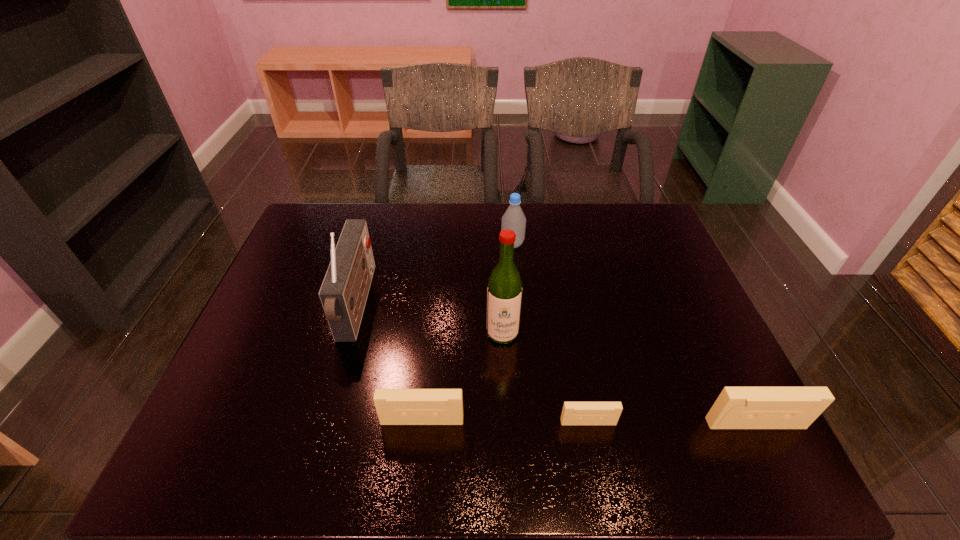
Locate an element on the screen. The height and width of the screenshot is (540, 960). object that is the closest to the shortest object is located at coordinates (736, 407).

What are the coordinates of `object that stands as the third closest to the shortest videotape` in the screenshot? It's located at (504, 292).

Locate which videotape is the closest to the shortest videotape. Please provide its 2D coordinates. Your answer should be formatted as a tuple, i.e. [(x, y)], where the tuple contains the x and y coordinates of a point satisfying the conditions above.

[(736, 407)]

Select which videotape appears as the second closest to the second videotape from left to right. Please provide its 2D coordinates. Your answer should be formatted as a tuple, i.e. [(x, y)], where the tuple contains the x and y coordinates of a point satisfying the conditions above.

[(394, 406)]